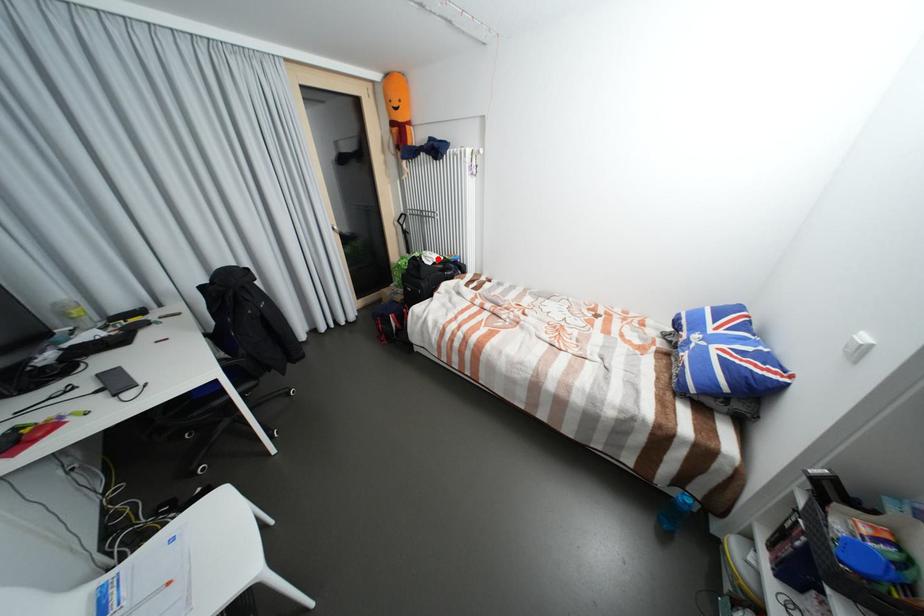
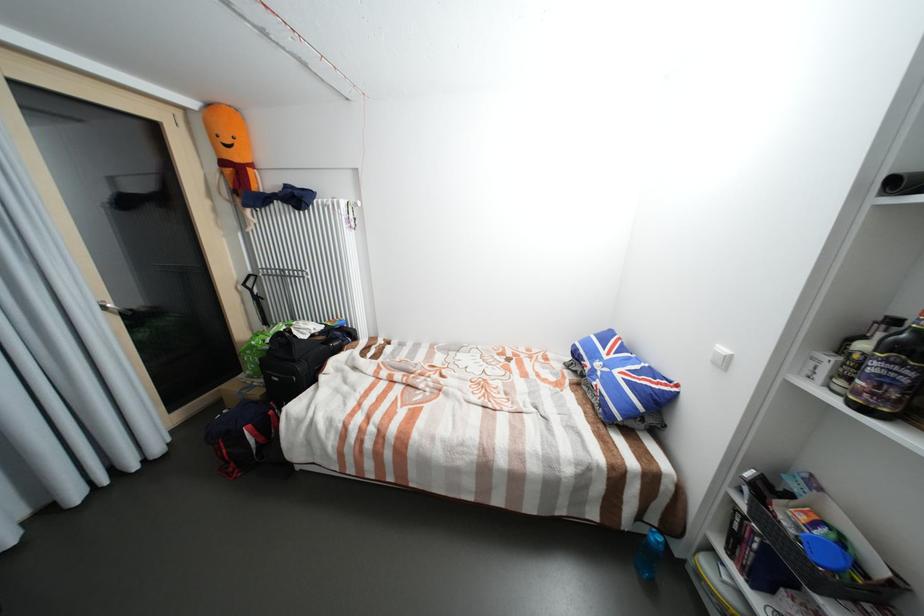
Where in the second image is the point corresponding to the highlighted location from the first image?

(313, 330)